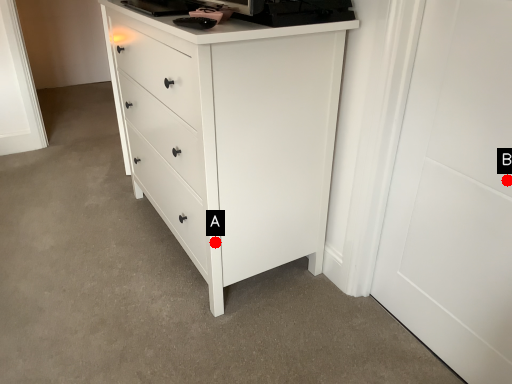
Question: Two points are circled on the image, labeled by A and B beside each circle. Which point is further to the camera?

Choices:
 (A) A is further
 (B) B is further

Answer: (A)